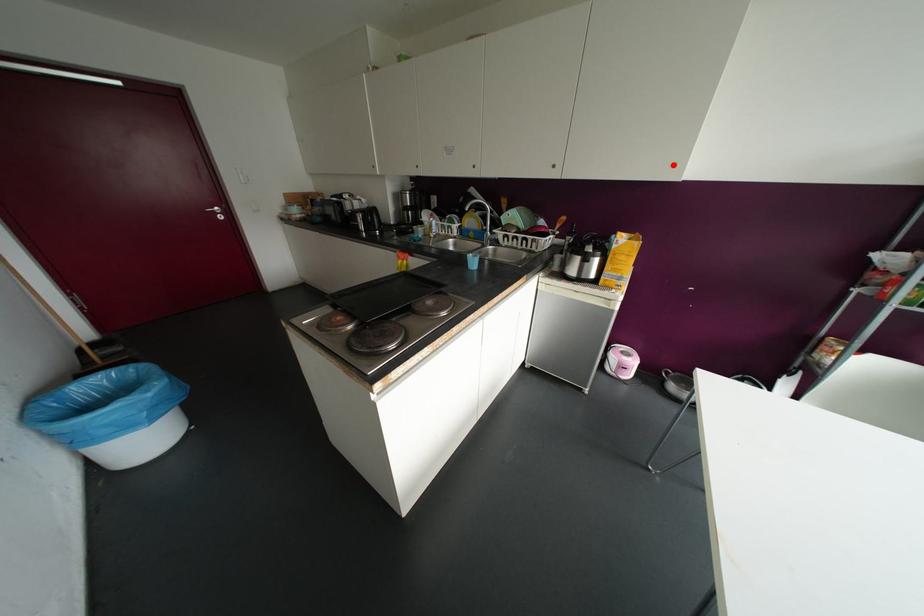
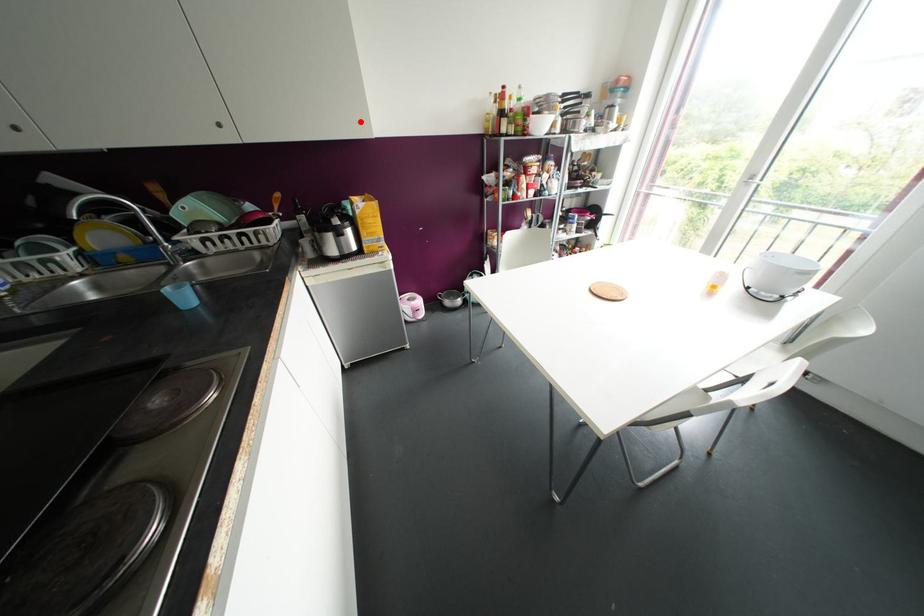
I am providing you with two images of the same scene from different viewpoints. A red point is marked on the first image and another point is marked on the second image. Is the marked point in image1 the same physical position as the marked point in image2?

Yes